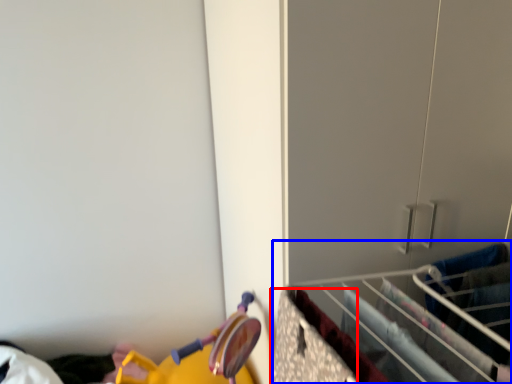
Question: Among these objects, which one is nearest to the camera, drawer (highlighted by a red box) or closet (highlighted by a blue box)?

Choices:
 (A) drawer
 (B) closet

Answer: (A)